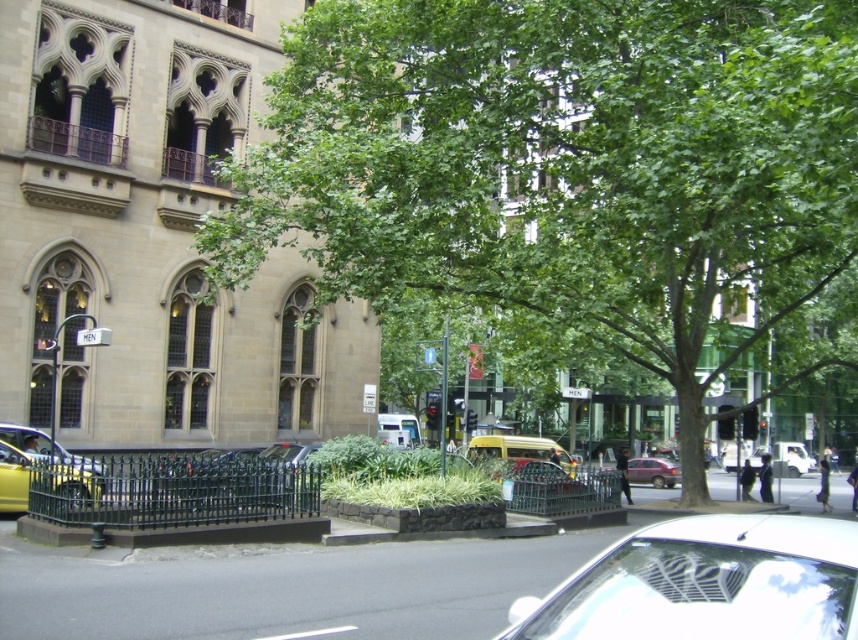
Is point (547, 445) behind point (668, 480)?

No, (547, 445) is closer to viewer.

Can you confirm if yellow matte taxi at center is positioned to the right of matte red car at center?

In fact, yellow matte taxi at center is to the left of matte red car at center.

Is point (535, 436) positioned behind point (663, 481)?

Yes, point (535, 436) is farther from viewer.

This screenshot has width=858, height=640. In order to click on yellow matte taxi at center in this screenshot , I will do (x=520, y=449).

Between white glossy car at lower right and yellow matte taxi at center, which one appears on the left side from the viewer's perspective?

Positioned to the left is white glossy car at lower right.

Does white glossy car at lower right appear under yellow matte taxi at center?

Actually, white glossy car at lower right is above yellow matte taxi at center.

Which is in front, point (680, 534) or point (475, 440)?

Point (680, 534)

You are a GUI agent. You are given a task and a screenshot of the screen. Output one action in this format:
    pyautogui.click(x=<x>, y=<y>)
    Task: Click on the white glossy car at lower right
    Image resolution: width=858 pixels, height=640 pixels.
    Given the screenshot: What is the action you would take?
    pyautogui.click(x=707, y=582)

Between green leafy tree at center and yellow matte taxi cab at left, which one appears on the right side from the viewer's perspective?

Positioned to the right is green leafy tree at center.

Does point (733, 285) lie in front of point (3, 440)?

No, it is behind (3, 440).

Between point (554, 40) and point (1, 429), which one is positioned in front?

Point (554, 40) is in front.

Where is `green leafy tree at center`? Image resolution: width=858 pixels, height=640 pixels. green leafy tree at center is located at coordinates coord(565,166).